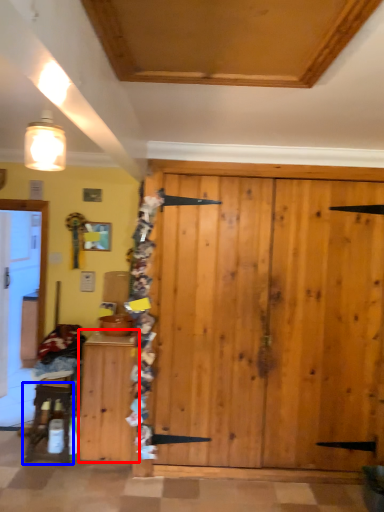
Question: Which point is closer to the camera, cabinetry (highlighted by a red box) or furniture (highlighted by a blue box)?

Choices:
 (A) cabinetry
 (B) furniture

Answer: (A)